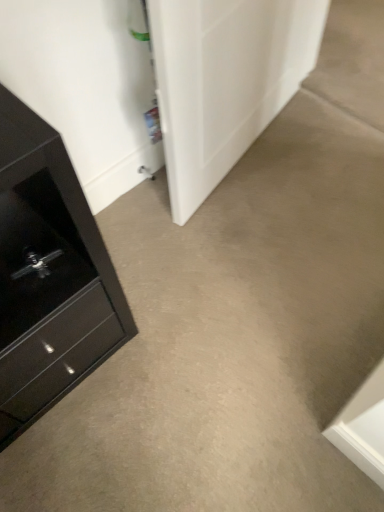
Locate an element on the screen. white matte door at center is located at coordinates (224, 81).

The height and width of the screenshot is (512, 384). Describe the element at coordinates (224, 81) in the screenshot. I see `white matte door at center` at that location.

What is the approximate height of white matte door at center?

It is 29.72 inches.

Measure the distance between point (257, 133) and camera.

A distance of 1.62 meters exists between point (257, 133) and camera.

Identify the location of white matte door at center. (224, 81).